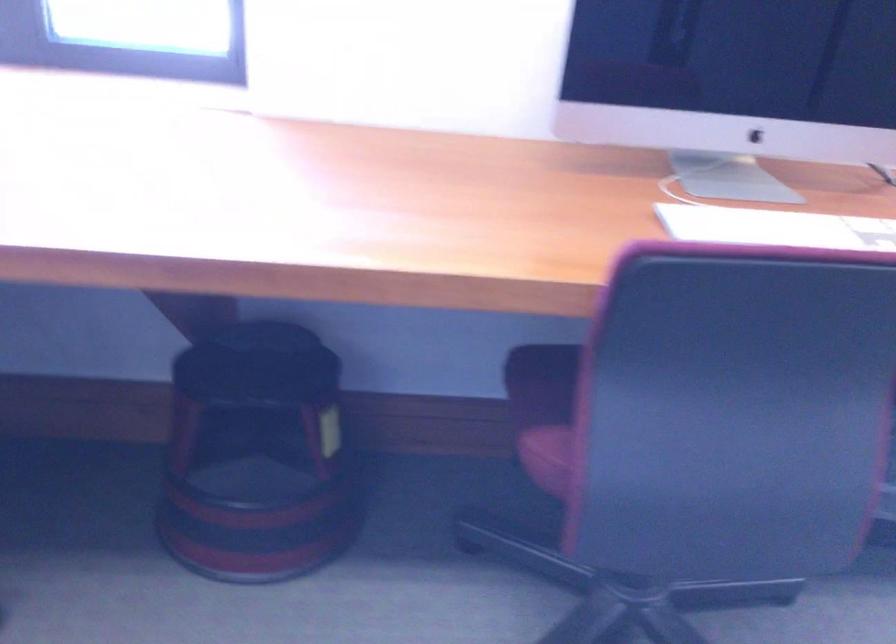
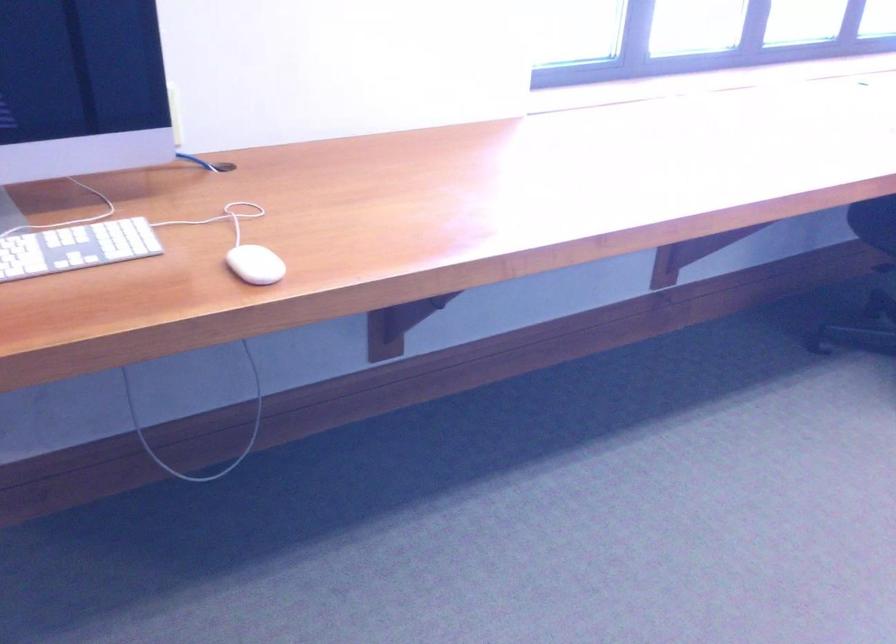
Question: Which direction would the cameraman need to move to produce the second image? Reply with the corresponding letter.

Choices:
 (A) Left
 (B) Right
 (C) Forward
 (D) Backward

Answer: (A)